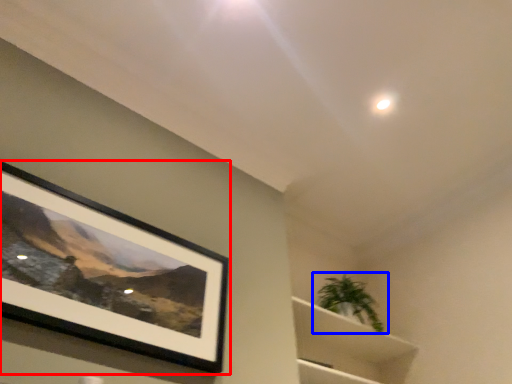
Question: Which object is further to the camera taking this photo, picture frame (highlighted by a red box) or houseplant (highlighted by a blue box)?

Choices:
 (A) picture frame
 (B) houseplant

Answer: (B)